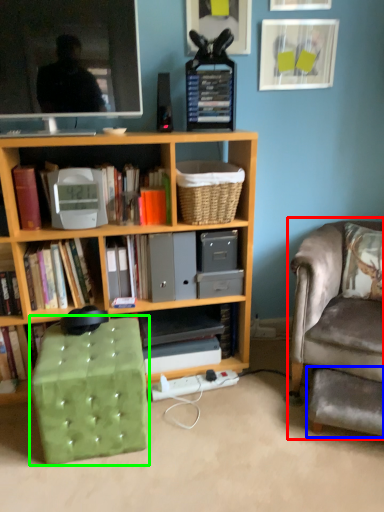
Question: Considering the real-world distances, which object is closest to chair (highlighted by a red box)? footrest (highlighted by a blue box) or music stool (highlighted by a green box).

Choices:
 (A) footrest
 (B) music stool

Answer: (A)